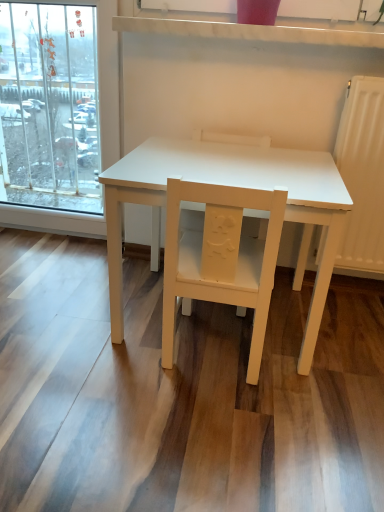
Question: Considering the relative positions of white matte chair at center, which appears as the 2th chair when viewed from the front, and matte yellow chair at center, arranged as the second chair when viewed from the back, in the image provided, is white matte chair at center, which appears as the 2th chair when viewed from the front, to the left or to the right of matte yellow chair at center, arranged as the second chair when viewed from the back,?

Choices:
 (A) right
 (B) left

Answer: (A)

Question: Considering their positions, is white matte chair at center, which appears as the 2th chair when viewed from the front, located in front of or behind matte yellow chair at center, the 1th chair positioned from the front?

Choices:
 (A) behind
 (B) front

Answer: (A)

Question: Estimate the real-world distances between objects in this image. Which object is closer to the white matte table at center?

Choices:
 (A) white matte chair at center, which appears as the 2th chair when viewed from the front
 (B) matte yellow chair at center, arranged as the second chair when viewed from the back

Answer: (B)

Question: Considering the real-world distances, which object is closest to the matte yellow chair at center, the 1th chair positioned from the front?

Choices:
 (A) white matte chair at center, which appears as the 2th chair when viewed from the front
 (B) white matte table at center

Answer: (B)